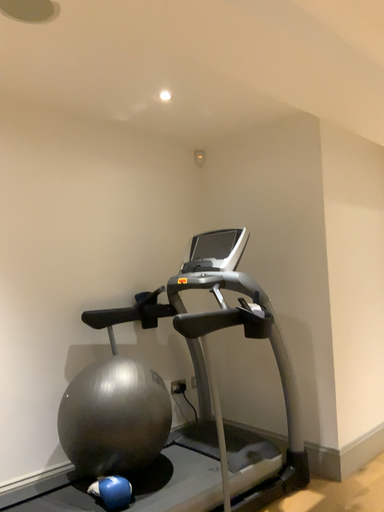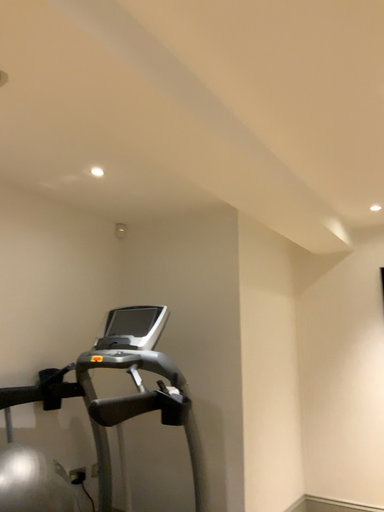
Question: How did the camera likely rotate when shooting the video?

Choices:
 (A) rotated left
 (B) rotated right

Answer: (B)